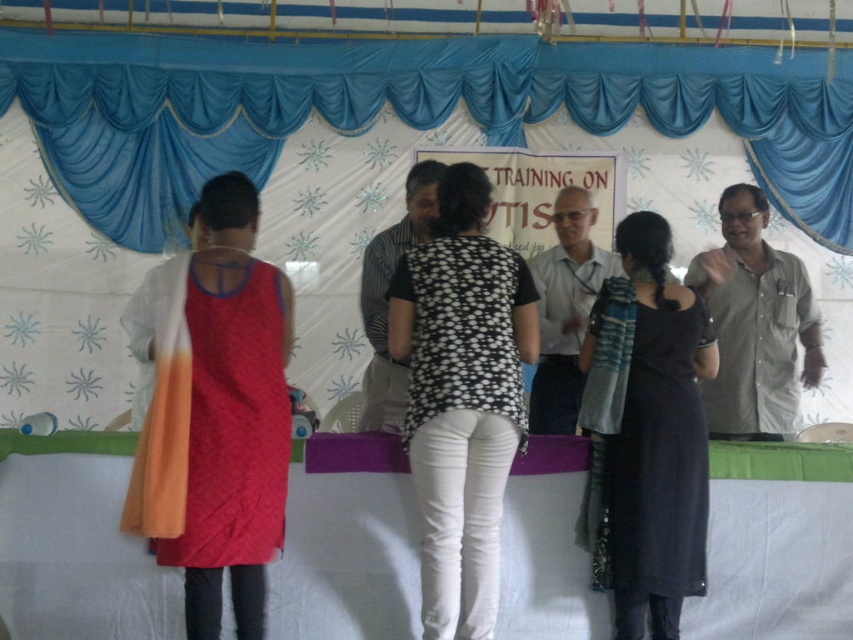
Image resolution: width=853 pixels, height=640 pixels. What are the coordinates of `black dotted shirt at center` in the screenshot? It's located at (461, 397).

Does black dotted shirt at center come behind black woolen dress at center?

No, it is in front of black woolen dress at center.

Is point (433, 628) farther from camera compared to point (693, 588)?

No.

Locate an element on the screen. This screenshot has height=640, width=853. black dotted shirt at center is located at coordinates (461, 397).

Is orange fabric dress at left to the right of black woolen dress at center from the viewer's perspective?

No, orange fabric dress at left is not to the right of black woolen dress at center.

Does point (155, 468) come in front of point (605, 584)?

Yes.

Identify the location of orange fabric dress at left. (213, 412).

Locate an element on the screen. This screenshot has width=853, height=640. blue fabric canopy at upper center is located at coordinates (550, 170).

Image resolution: width=853 pixels, height=640 pixels. What do you see at coordinates (550, 170) in the screenshot?
I see `blue fabric canopy at upper center` at bounding box center [550, 170].

This screenshot has width=853, height=640. In order to click on blue fabric canopy at upper center in this screenshot , I will do `click(550, 170)`.